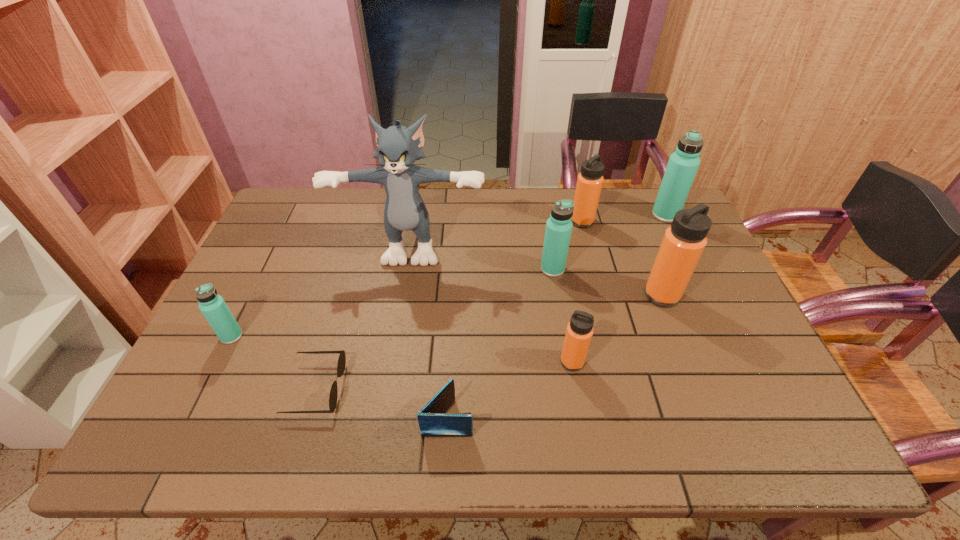
Find the location of a particular element. The image size is (960, 540). the second closest orange thermos bottle to the biggest aqua thermos bottle is located at coordinates (684, 241).

Select which orange thermos bottle is the second closest to the blue wallet. Please provide its 2D coordinates. Your answer should be formatted as a tuple, i.e. [(x, y)], where the tuple contains the x and y coordinates of a point satisfying the conditions above.

[(684, 241)]

The image size is (960, 540). I want to click on vacant area that satisfies the following two spatial constraints: 1. on the back side of the sixth farthest object; 2. on the right side of the rightmost object, so click(292, 215).

Locate an element on the screen. vacant region that satisfies the following two spatial constraints: 1. on the front side of the fourth farthest thermos bottle; 2. on the front-facing side of the black sunglasses is located at coordinates (699, 388).

Image resolution: width=960 pixels, height=540 pixels. I want to click on vacant area that satisfies the following two spatial constraints: 1. on the back side of the rightmost aqua thermos bottle; 2. on the right side of the second orange thermos bottle from left to right, so click(x=580, y=215).

Locate an element on the screen. vacant area in the image that satisfies the following two spatial constraints: 1. on the front side of the second biggest orange thermos bottle; 2. on the front-facing side of the shortest object is located at coordinates [x=626, y=388].

Identify the location of free space that satisfies the following two spatial constraints: 1. on the back side of the nearest thermos bottle; 2. on the right side of the second thermos bottle from right to left. (561, 295).

The height and width of the screenshot is (540, 960). I want to click on vacant region that satisfies the following two spatial constraints: 1. on the front side of the nearest orange thermos bottle; 2. on the front-facing side of the sunglasses, so click(x=577, y=388).